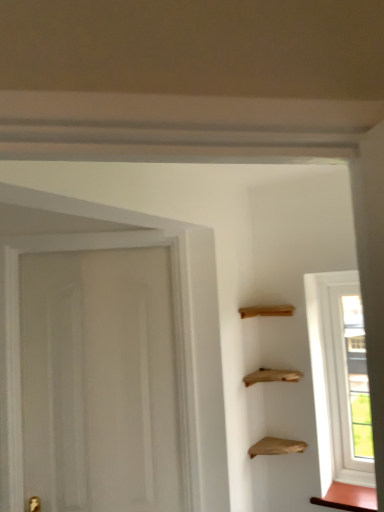
At what (x,y) coordinates should I click in order to perform the action: click on matte brown cabinet at lower right, the second cabinetry viewed from the top. Please return your answer as a coordinate pair (x, y). This screenshot has width=384, height=512. Looking at the image, I should click on (348, 498).

The image size is (384, 512). What do you see at coordinates (340, 388) in the screenshot?
I see `transparent glass window at right` at bounding box center [340, 388].

The image size is (384, 512). I want to click on wooden shelves at upper right, which appears as the first cabinetry when viewed from the top, so click(x=281, y=411).

Locate an element on the screen. The height and width of the screenshot is (512, 384). matte brown cabinet at lower right, the second cabinetry viewed from the top is located at coordinates (348, 498).

From the image's perspective, is wooden shelves at upper right, the 1th cabinetry when ordered from left to right, on top of matte brown cabinet at lower right, the second cabinetry viewed from the top?

Yes, from the image's perspective, wooden shelves at upper right, the 1th cabinetry when ordered from left to right, is over matte brown cabinet at lower right, the second cabinetry viewed from the top.

Is wooden shelves at upper right, which appears as the second cabinetry when ordered from the bottom, looking in the opposite direction of matte brown cabinet at lower right, which is the 1th cabinetry in bottom-to-top order?

wooden shelves at upper right, which appears as the second cabinetry when ordered from the bottom, is not turned away from matte brown cabinet at lower right, which is the 1th cabinetry in bottom-to-top order.

Which is behind, wooden shelves at upper right, arranged as the 2th cabinetry when viewed from the right, or matte brown cabinet at lower right, marked as the first cabinetry in a right-to-left arrangement?

matte brown cabinet at lower right, marked as the first cabinetry in a right-to-left arrangement, is further from the camera.

Is wooden shelves at upper right, arranged as the 2th cabinetry when viewed from the right, located outside matte brown cabinet at lower right, marked as the first cabinetry in a right-to-left arrangement?

That's correct, wooden shelves at upper right, arranged as the 2th cabinetry when viewed from the right, is outside of matte brown cabinet at lower right, marked as the first cabinetry in a right-to-left arrangement.

How far apart are matte brown cabinet at lower right, which ranks as the 2th cabinetry in left-to-right order, and wooden shelves at upper right, which appears as the second cabinetry when ordered from the bottom?

matte brown cabinet at lower right, which ranks as the 2th cabinetry in left-to-right order, and wooden shelves at upper right, which appears as the second cabinetry when ordered from the bottom, are 14.03 inches apart.

Can you confirm if matte brown cabinet at lower right, which is the 1th cabinetry in bottom-to-top order, is thinner than wooden shelves at upper right, the 1th cabinetry when ordered from left to right?

No, matte brown cabinet at lower right, which is the 1th cabinetry in bottom-to-top order, is not thinner than wooden shelves at upper right, the 1th cabinetry when ordered from left to right.

From a real-world perspective, is matte brown cabinet at lower right, the second cabinetry viewed from the top, positioned over wooden shelves at upper right, the 1th cabinetry when ordered from left to right, based on gravity?

No, from a real-world perspective, matte brown cabinet at lower right, the second cabinetry viewed from the top, is not on top of wooden shelves at upper right, the 1th cabinetry when ordered from left to right.

Is matte brown cabinet at lower right, which is the 1th cabinetry in bottom-to-top order, positioned behind wooden shelves at upper right, the 1th cabinetry when ordered from left to right?

Yes, it is.

Between wooden shelves at upper right, arranged as the 2th cabinetry when viewed from the right, and transparent glass window at right, which one has smaller size?

transparent glass window at right is smaller.

Considering the relative positions of wooden shelves at upper right, arranged as the 2th cabinetry when viewed from the right, and transparent glass window at right in the image provided, is wooden shelves at upper right, arranged as the 2th cabinetry when viewed from the right, in front of transparent glass window at right?

Yes, wooden shelves at upper right, arranged as the 2th cabinetry when viewed from the right, is closer to the camera.

Is wooden shelves at upper right, arranged as the 2th cabinetry when viewed from the right, to the left of transparent glass window at right from the viewer's perspective?

Indeed, wooden shelves at upper right, arranged as the 2th cabinetry when viewed from the right, is positioned on the left side of transparent glass window at right.

From the image's perspective, is wooden shelves at upper right, the 1th cabinetry when ordered from left to right, on top of transparent glass window at right?

Yes.

Is transparent glass window at right directly adjacent to matte brown cabinet at lower right, marked as the first cabinetry in a right-to-left arrangement?

transparent glass window at right and matte brown cabinet at lower right, marked as the first cabinetry in a right-to-left arrangement, are not in contact.

Do you think transparent glass window at right is within matte brown cabinet at lower right, which is the 1th cabinetry in bottom-to-top order, or outside of it?

transparent glass window at right lies outside matte brown cabinet at lower right, which is the 1th cabinetry in bottom-to-top order.

Who is more distant, transparent glass window at right or matte brown cabinet at lower right, which is the 1th cabinetry in bottom-to-top order?

transparent glass window at right is behind.

Which of these two, transparent glass window at right or matte brown cabinet at lower right, the second cabinetry viewed from the top, is smaller?

Smaller between the two is matte brown cabinet at lower right, the second cabinetry viewed from the top.

Which is in front, transparent glass window at right or wooden shelves at upper right, which appears as the second cabinetry when ordered from the bottom?

wooden shelves at upper right, which appears as the second cabinetry when ordered from the bottom, is in front.

Considering the positions of point (373, 486) and point (295, 426), is point (373, 486) closer or farther from the camera than point (295, 426)?

Point (373, 486) is positioned closer to the camera compared to point (295, 426).

From the image's perspective, is transparent glass window at right on wooden shelves at upper right, the 1th cabinetry when ordered from left to right?

Actually, transparent glass window at right appears below wooden shelves at upper right, the 1th cabinetry when ordered from left to right, in the image.

Is matte brown cabinet at lower right, marked as the first cabinetry in a right-to-left arrangement, with transparent glass window at right?

There is a gap between matte brown cabinet at lower right, marked as the first cabinetry in a right-to-left arrangement, and transparent glass window at right.

Which of these two, matte brown cabinet at lower right, which ranks as the 2th cabinetry in left-to-right order, or transparent glass window at right, is smaller?

Smaller between the two is matte brown cabinet at lower right, which ranks as the 2th cabinetry in left-to-right order.

From a real-world perspective, is matte brown cabinet at lower right, the second cabinetry viewed from the top, over transparent glass window at right?

No, from a real-world perspective, matte brown cabinet at lower right, the second cabinetry viewed from the top, is not on top of transparent glass window at right.

Identify the location of cabinetry that is behind the wooden shelves at upper right, which appears as the first cabinetry when viewed from the top. point(348,498).

In order to click on cabinetry that is on the right side of wooden shelves at upper right, arranged as the 2th cabinetry when viewed from the right in this screenshot , I will do `click(348, 498)`.

Based on the photo, considering their positions, is matte brown cabinet at lower right, which is the 1th cabinetry in bottom-to-top order, positioned closer to transparent glass window at right than wooden shelves at upper right, which appears as the first cabinetry when viewed from the top?

The object closer to transparent glass window at right is wooden shelves at upper right, which appears as the first cabinetry when viewed from the top.

Based on their spatial positions, is transparent glass window at right or matte brown cabinet at lower right, marked as the first cabinetry in a right-to-left arrangement, closer to wooden shelves at upper right, arranged as the 2th cabinetry when viewed from the right?

transparent glass window at right is closer to wooden shelves at upper right, arranged as the 2th cabinetry when viewed from the right.

Looking at the image, which one is located closer to matte brown cabinet at lower right, marked as the first cabinetry in a right-to-left arrangement, wooden shelves at upper right, which appears as the first cabinetry when viewed from the top, or transparent glass window at right?

transparent glass window at right is positioned closer to the anchor matte brown cabinet at lower right, marked as the first cabinetry in a right-to-left arrangement.

From the image, which object appears to be farther from transparent glass window at right, wooden shelves at upper right, which appears as the first cabinetry when viewed from the top, or matte brown cabinet at lower right, which is the 1th cabinetry in bottom-to-top order?

matte brown cabinet at lower right, which is the 1th cabinetry in bottom-to-top order, is positioned further to the anchor transparent glass window at right.

Looking at the image, which one is located further to wooden shelves at upper right, the 1th cabinetry when ordered from left to right, matte brown cabinet at lower right, marked as the first cabinetry in a right-to-left arrangement, or transparent glass window at right?

matte brown cabinet at lower right, marked as the first cabinetry in a right-to-left arrangement, lies further to wooden shelves at upper right, the 1th cabinetry when ordered from left to right, than the other object.

When comparing their distances from matte brown cabinet at lower right, which is the 1th cabinetry in bottom-to-top order, does transparent glass window at right or wooden shelves at upper right, which appears as the first cabinetry when viewed from the top, seem further?

The object further to matte brown cabinet at lower right, which is the 1th cabinetry in bottom-to-top order, is wooden shelves at upper right, which appears as the first cabinetry when viewed from the top.

The width and height of the screenshot is (384, 512). In order to click on window between wooden shelves at upper right, which appears as the second cabinetry when ordered from the bottom, and matte brown cabinet at lower right, marked as the first cabinetry in a right-to-left arrangement, in the vertical direction in this screenshot , I will do `click(340, 388)`.